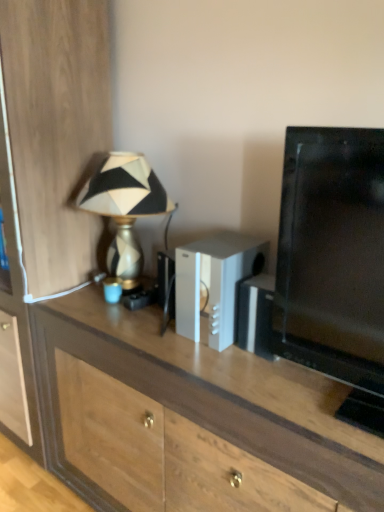
Question: In the image, is gold textured lamp at left positioned in front of or behind wooden cabinet at left?

Choices:
 (A) front
 (B) behind

Answer: (B)

Question: Is gold textured lamp at left wider or thinner than wooden cabinet at left?

Choices:
 (A) thin
 (B) wide

Answer: (A)

Question: Estimate the real-world distances between objects in this image. Which object is closer to the wooden desk at center?

Choices:
 (A) silver metallic speaker at center
 (B) wooden cabinet at left
 (C) gold textured lamp at left

Answer: (A)

Question: Which object is positioned closest to the wooden desk at center?

Choices:
 (A) silver metallic speaker at center
 (B) gold textured lamp at left
 (C) wooden cabinet at left

Answer: (A)